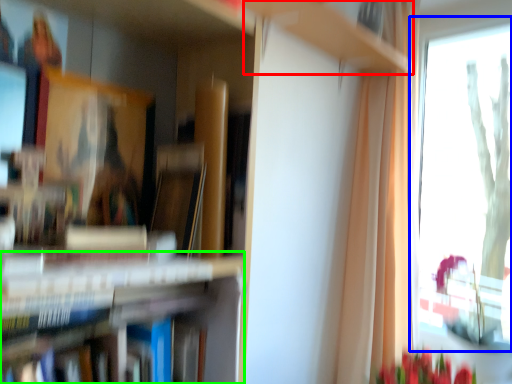
Question: Which is farther away from cabinet (highlighted by a red box)? window (highlighted by a blue box) or bookshelf (highlighted by a green box)?

Choices:
 (A) window
 (B) bookshelf

Answer: (A)